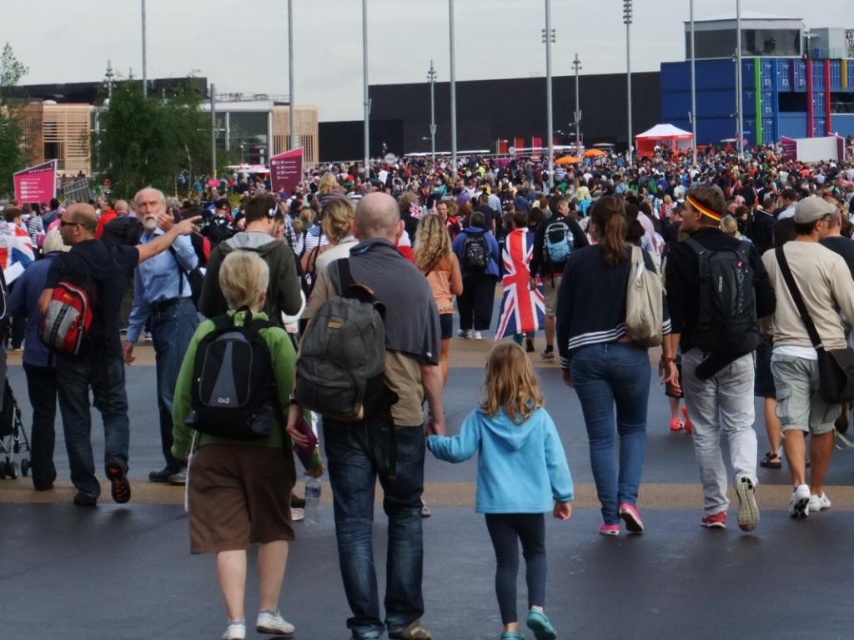
Question: Based on their relative distances, which object is farther from the light blue fleece at center?

Choices:
 (A) dark gray backpack at center
 (B) white cotton t-shirt at center-right

Answer: (B)

Question: Which is farther from the matte black backpack at center-right?

Choices:
 (A) dark gray backpack at center
 (B) light blue fleece at center
 (C) dark blue sweater at center
 (D) white cotton t-shirt at center-right

Answer: (A)

Question: Does dark gray backpack at center appear under matte black backpack at center-right?

Choices:
 (A) yes
 (B) no

Answer: (A)

Question: Is dark blue sweater at center to the right of light blue fleece at center from the viewer's perspective?

Choices:
 (A) yes
 (B) no

Answer: (A)

Question: Estimate the real-world distances between objects in this image. Which object is farther from the black matte backpack at center-left?

Choices:
 (A) light blue fleece at center
 (B) matte black backpack at center-right
 (C) dark blue sweater at center

Answer: (B)

Question: Is dark gray backpack at center thinner than black matte backpack at center-left?

Choices:
 (A) yes
 (B) no

Answer: (A)